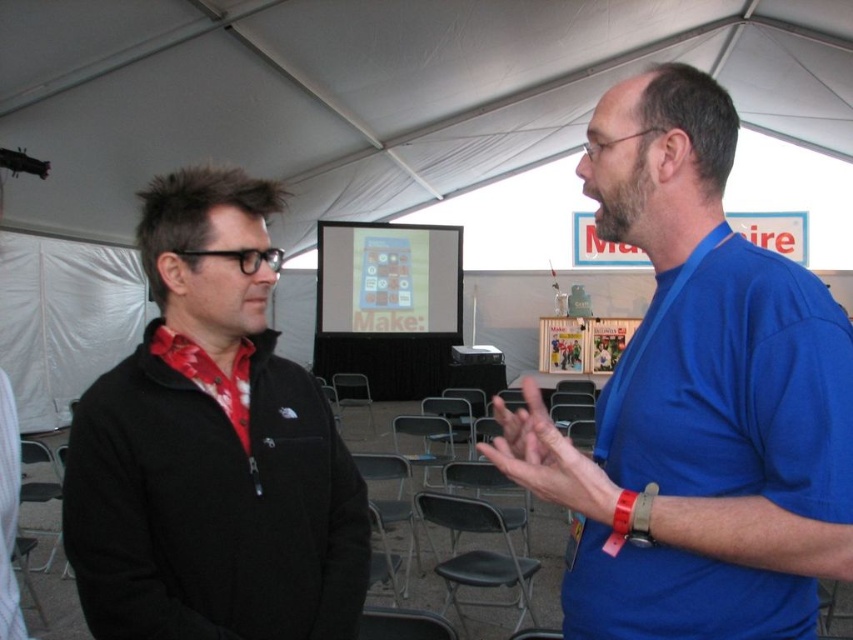
You are attending a Make magazine event and see two people talking under a tent. The blue fabric shirt at right and the black fleece jacket at left are part of their outfits. Which person is positioned higher relative to the other?

The blue fabric shirt at right is above the black fleece jacket at left, so the person wearing the blue fabric shirt at right is positioned higher.

You are a photographer at the event and need to capture a closeup of both the blue fabric shirt at right and the black fleece jacket at left without any blur. Your camera has a depth of field that can focus on objects within a 20 inch range. Can you focus on both subjects simultaneously?

The blue fabric shirt at right and the black fleece jacket at left are 21.50 inches apart from each other. Since the distance between them exceeds the camera lens depth of field range of 20 inches, you cannot focus on both subjects simultaneously without one appearing blurred.